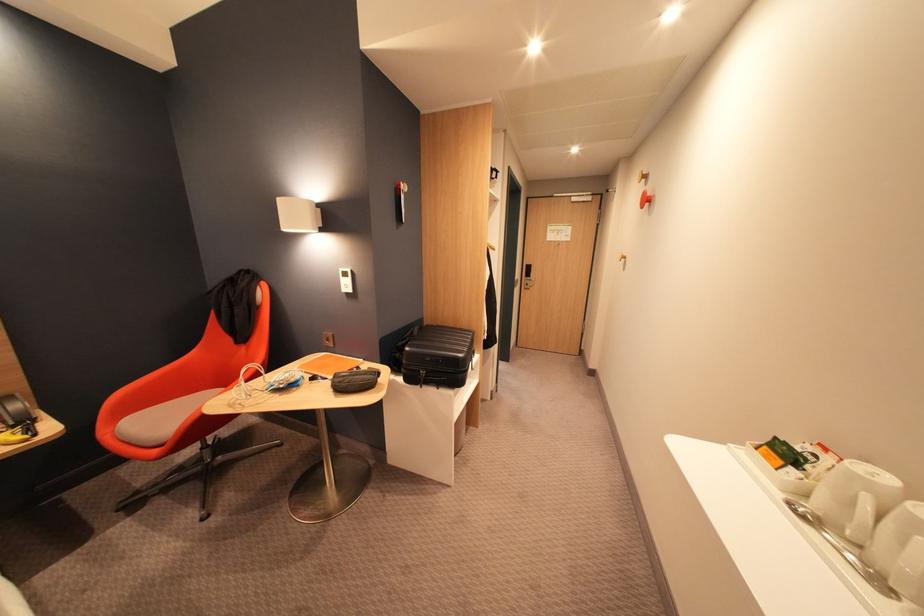
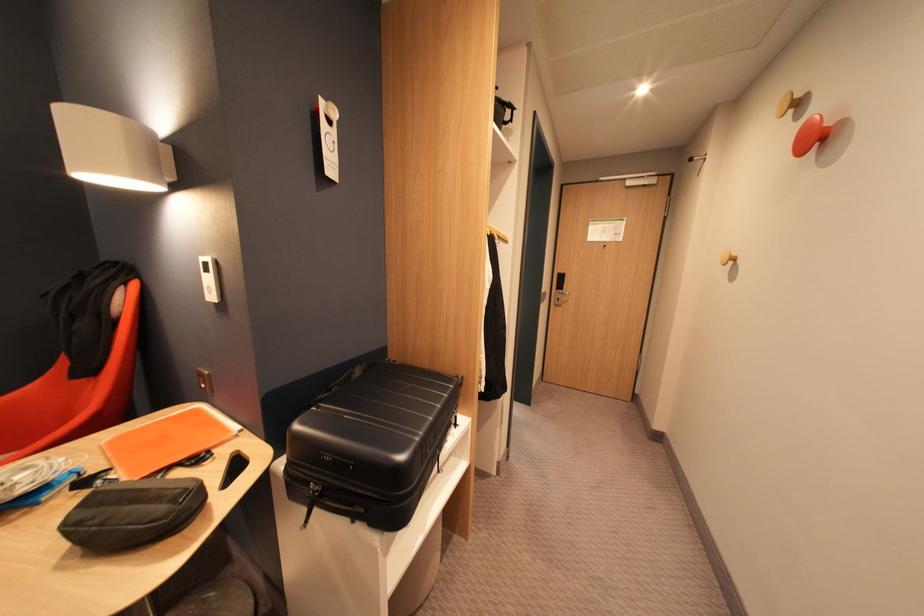
Find the pixel in the second image that matches (383,378) in the first image.

(186, 508)